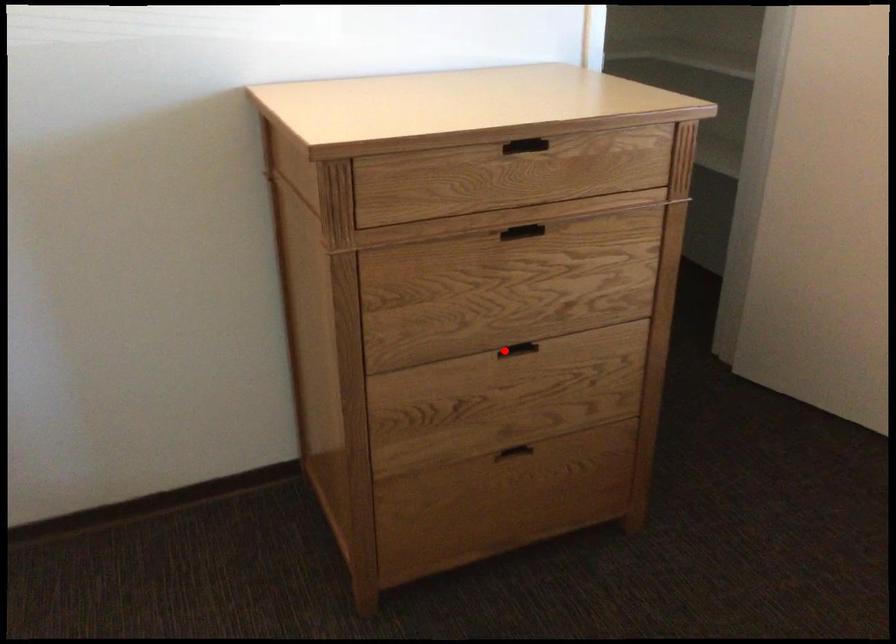
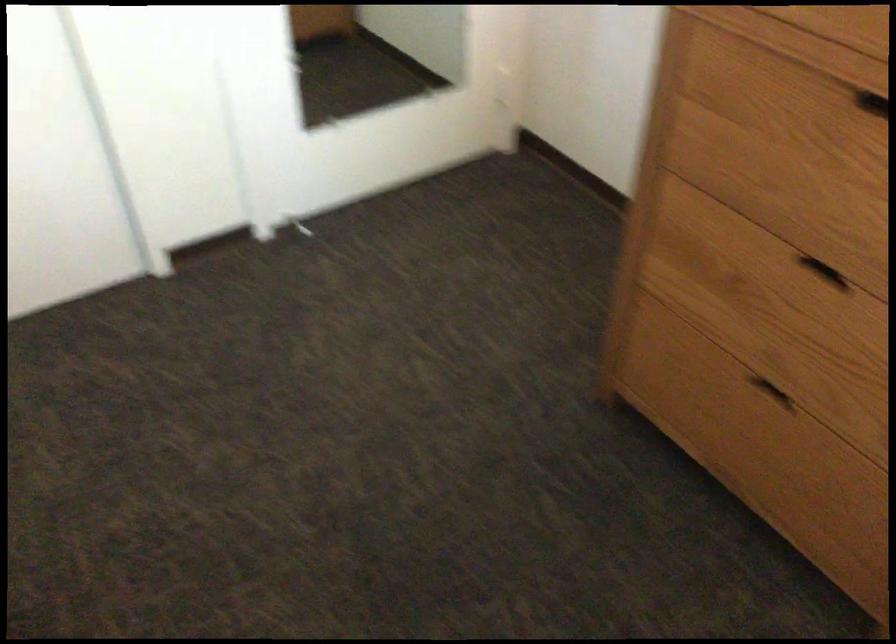
Find the pixel in the second image that matches the highlighted location in the first image.

(824, 272)